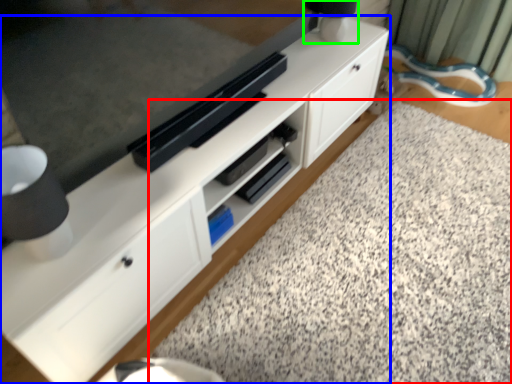
Question: Estimate the real-world distances between objects in this image. Which object is farther from granite (highlighted by a red box), cabinetry (highlighted by a blue box) or table lamp (highlighted by a green box)?

Choices:
 (A) cabinetry
 (B) table lamp

Answer: (B)